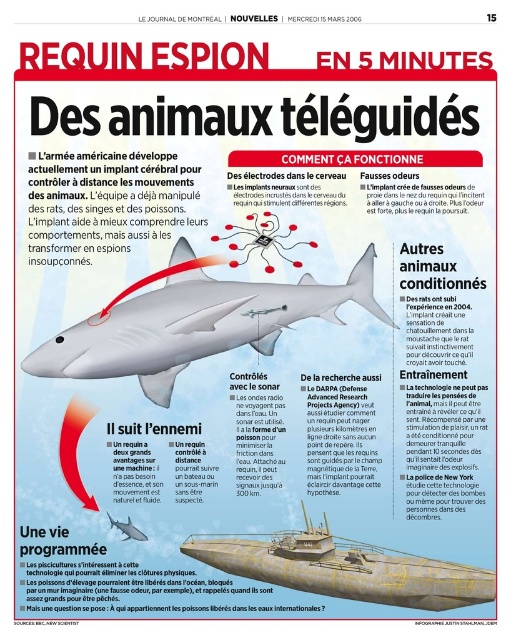
Question: Is matte black shark at center smaller than brushed metal submarine at lower center?

Choices:
 (A) yes
 (B) no

Answer: (B)

Question: Which of the following is the farthest from the observer?

Choices:
 (A) matte black shark at center
 (B) matte black shark at lower left
 (C) brushed metal submarine at lower center

Answer: (B)

Question: Is matte black shark at center positioned behind brushed metal submarine at lower center?

Choices:
 (A) yes
 (B) no

Answer: (A)

Question: Is matte black shark at center positioned at the back of brushed metal submarine at lower center?

Choices:
 (A) no
 (B) yes

Answer: (B)

Question: Which point is closer to the camera taking this photo?

Choices:
 (A) (134, 538)
 (B) (177, 300)
 (C) (435, 604)

Answer: (C)

Question: Which point is farther from the camera taking this photo?

Choices:
 (A) (300, 588)
 (B) (268, 353)

Answer: (B)